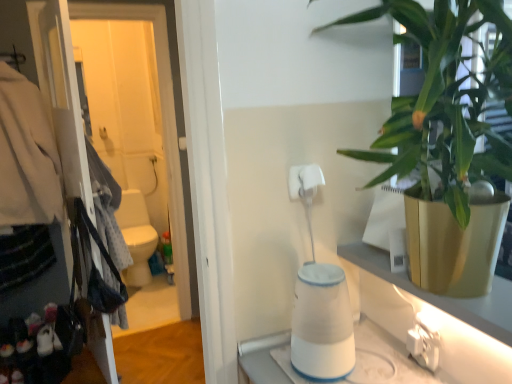
Describe the element at coordinates (136, 237) in the screenshot. The width and height of the screenshot is (512, 384). I see `white glossy toilet at center` at that location.

The height and width of the screenshot is (384, 512). What do you see at coordinates (27, 156) in the screenshot?
I see `matte black coat hanger at left` at bounding box center [27, 156].

In order to face white glossy screen door at left, should I rotate leftwards or rightwards?

Rotate your view left by about 17.245°.

Locate an element on the screen. This screenshot has height=384, width=512. white glossy toilet at center is located at coordinates (136, 237).

From a real-world perspective, is matte black coat hanger at left positioned above or below white plastic electric outlet at lower right?

In terms of real-world spatial position, matte black coat hanger at left is above white plastic electric outlet at lower right.

How different are the orientations of matte black coat hanger at left and white plastic electric outlet at lower right in degrees?

172 degrees.

Which object is wider, matte black coat hanger at left or white plastic electric outlet at lower right?

matte black coat hanger at left is wider.

Is point (11, 181) closer or farther from the camera than point (434, 322)?

Point (11, 181) appears to be farther away from the viewer than point (434, 322).

Is white plastic electric outlet at lower right shorter than matte black coat hanger at left?

Indeed, white plastic electric outlet at lower right has a lesser height compared to matte black coat hanger at left.

The image size is (512, 384). In the image, there is a matte black coat hanger at left. Identify the location of electric outlet below it (from a real-world perspective). (424, 341).

Is white plastic electric outlet at lower right positioned behind matte black coat hanger at left?

No, it is not.

From a real-world perspective, is white plastic electric outlet at lower right over matte black coat hanger at left?

No, from a real-world perspective, white plastic electric outlet at lower right is not on top of matte black coat hanger at left.

Which point is more forward, (72, 13) or (142, 209)?

The point (72, 13) is closer.

Does white glossy screen door at left have a larger size compared to white glossy toilet at center?

No.

Image resolution: width=512 pixels, height=384 pixels. Find the location of `sit below the white glossy screen door at left (from the image's perspective)`. sit below the white glossy screen door at left (from the image's perspective) is located at coordinates (136, 237).

How many degrees apart are the facing directions of white matte toilet paper at center and white plastic electric outlet at lower right?

93.6 degrees.

Is white matte toilet paper at center aimed at white plastic electric outlet at lower right?

No, white matte toilet paper at center does not turn towards white plastic electric outlet at lower right.

Considering the sizes of objects white matte toilet paper at center and white plastic electric outlet at lower right in the image provided, who is taller, white matte toilet paper at center or white plastic electric outlet at lower right?

white matte toilet paper at center.

From a real-world perspective, is white matte toilet paper at center below white plastic electric outlet at lower right?

Incorrect, from a real-world perspective, white matte toilet paper at center is higher than white plastic electric outlet at lower right.

How different are the orientations of white glossy toilet at center and white glossy screen door at left in degrees?

7.86 degrees.

Considering the points (146, 277) and (113, 66), which point is behind, point (146, 277) or point (113, 66)?

The point (113, 66) is behind.

Is white glossy toilet at center beside white glossy screen door at left?

white glossy toilet at center and white glossy screen door at left are not in contact.

Is white glossy toilet at center wider or thinner than white glossy screen door at left?

Clearly, white glossy toilet at center has more width compared to white glossy screen door at left.

What's the angular difference between green leafy plant at upper right and white plastic electric outlet at lower right's facing directions?

They differ by 3.26 degrees in their facing directions.

From a real-world perspective, who is located higher, green leafy plant at upper right or white plastic electric outlet at lower right?

green leafy plant at upper right.

Considering the sizes of green leafy plant at upper right and white plastic electric outlet at lower right in the image, is green leafy plant at upper right taller or shorter than white plastic electric outlet at lower right?

Clearly, green leafy plant at upper right is taller compared to white plastic electric outlet at lower right.

Where is `houseplant in front of the white plastic electric outlet at lower right`? houseplant in front of the white plastic electric outlet at lower right is located at coordinates (444, 133).

Considering the positions of objects white plastic electric outlet at lower right and white glossy screen door at left in the image provided, who is in front, white plastic electric outlet at lower right or white glossy screen door at left?

white plastic electric outlet at lower right is in front.

Is white plastic electric outlet at lower right situated inside white glossy screen door at left or outside?

The correct answer is: outside.

Considering the relative positions of white plastic electric outlet at lower right and white glossy screen door at left in the image provided, is white plastic electric outlet at lower right to the left or to the right of white glossy screen door at left?

white plastic electric outlet at lower right is to the right of white glossy screen door at left.

Where is `closet above the white plastic electric outlet at lower right (from the image's perspective)`? closet above the white plastic electric outlet at lower right (from the image's perspective) is located at coordinates (27, 156).

The width and height of the screenshot is (512, 384). What are the coordinates of `closet above the white plastic electric outlet at lower right (from a real-world perspective)` in the screenshot? It's located at (27, 156).

Considering their positions, is white plastic electric outlet at lower right positioned further to white glossy toilet at center than white matte toilet paper at center?

white plastic electric outlet at lower right.

Which object lies nearer to the anchor point white plastic electric outlet at lower right, green leafy plant at upper right or white matte toilet paper at center?

The object closer to white plastic electric outlet at lower right is white matte toilet paper at center.

Estimate the real-world distances between objects in this image. Which object is closer to matte black coat hanger at left, white glossy screen door at left or white glossy toilet at center?

white glossy toilet at center is closer to matte black coat hanger at left.

Looking at the image, which one is located further to white matte toilet paper at center, white glossy toilet at center or white glossy screen door at left?

The object further to white matte toilet paper at center is white glossy screen door at left.

From the image, which object appears to be nearer to white matte toilet paper at center, matte black coat hanger at left or white glossy screen door at left?

Among the two, matte black coat hanger at left is located nearer to white matte toilet paper at center.

From the picture: Based on their spatial positions, is white glossy toilet at center or green leafy plant at upper right closer to white matte toilet paper at center?

green leafy plant at upper right is positioned closer to the anchor white matte toilet paper at center.

Considering their positions, is white glossy toilet at center positioned further to white glossy screen door at left than white matte toilet paper at center?

The object further to white glossy screen door at left is white matte toilet paper at center.

Which object lies further to the anchor point white glossy toilet at center, green leafy plant at upper right or white matte toilet paper at center?

green leafy plant at upper right.

This screenshot has width=512, height=384. What are the coordinates of `screen door located between matte black coat hanger at left and white plastic electric outlet at lower right in the left-right direction` in the screenshot? It's located at (137, 132).

Where is `electric outlet located between green leafy plant at upper right and white glossy screen door at left in the depth direction`? This screenshot has width=512, height=384. electric outlet located between green leafy plant at upper right and white glossy screen door at left in the depth direction is located at coordinates (424, 341).

Find the location of a particular element. The image size is (512, 384). screen door located between white plastic electric outlet at lower right and white glossy toilet at center in the depth direction is located at coordinates (137, 132).

Where is `toilet paper located between green leafy plant at upper right and white glossy toilet at center in the depth direction`? Image resolution: width=512 pixels, height=384 pixels. toilet paper located between green leafy plant at upper right and white glossy toilet at center in the depth direction is located at coordinates (304, 180).